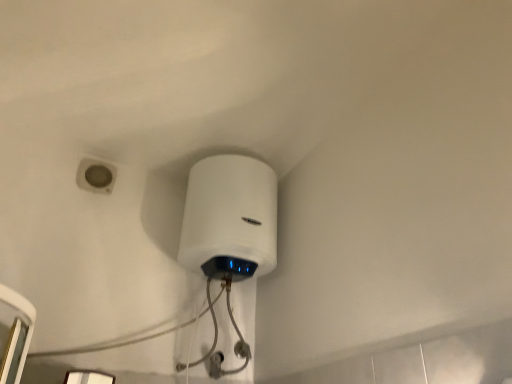
Describe the element at coordinates (230, 218) in the screenshot. I see `white glossy water heater at upper center` at that location.

The image size is (512, 384). I want to click on white glossy water heater at upper center, so click(230, 218).

Where is `white glossy water heater at upper center`? The width and height of the screenshot is (512, 384). white glossy water heater at upper center is located at coordinates click(230, 218).